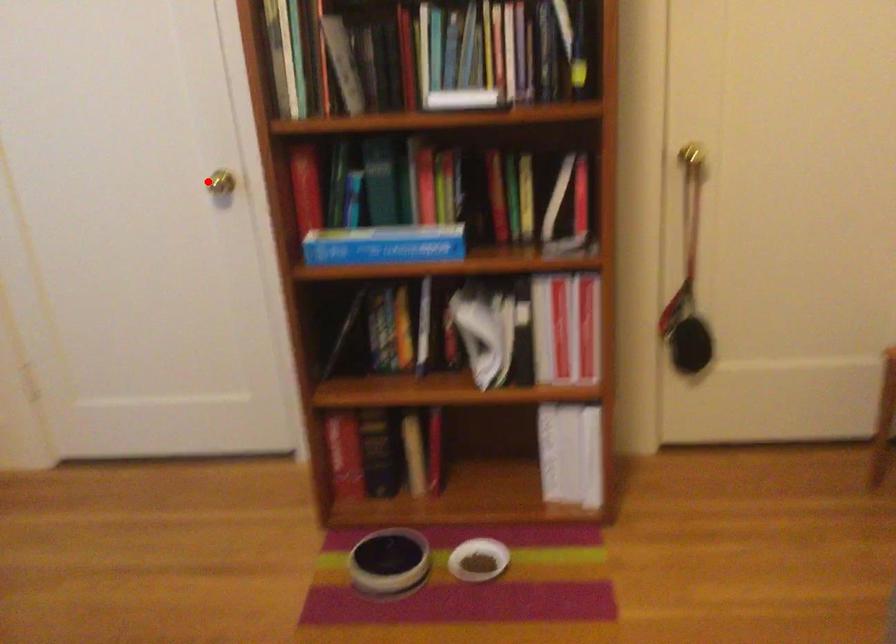
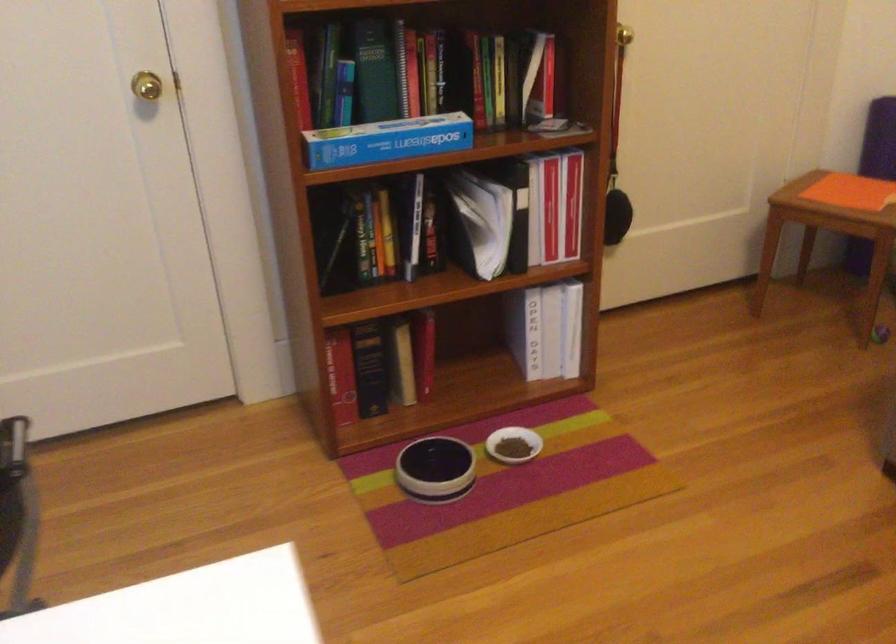
Question: A red point is marked in image1. In image2, is the corresponding 3D point closer to the camera or farther? Reply with the corresponding letter.

Choices:
 (A) The corresponding 3D point is closer.
 (B) The corresponding 3D point is farther.

Answer: (A)